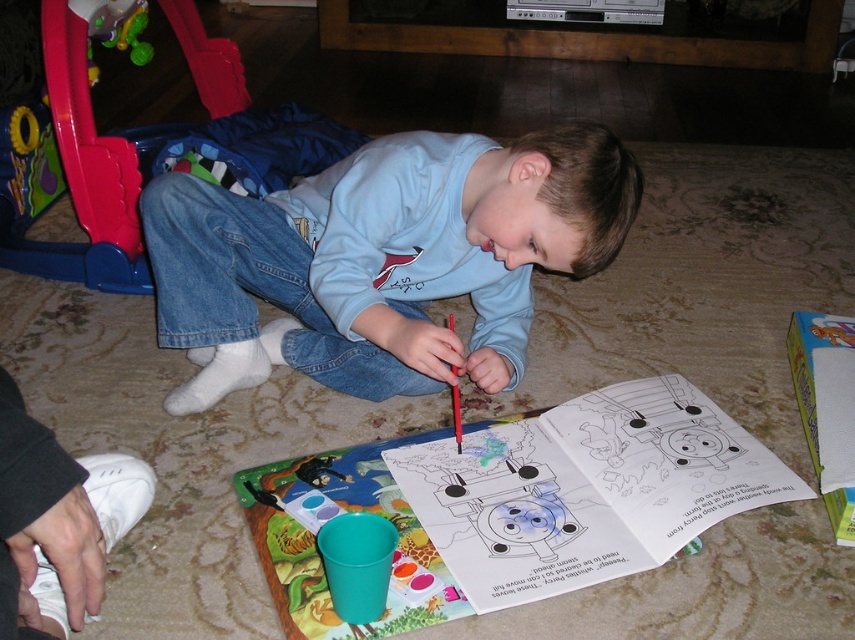
You are a parent trying to store the rubberized plastic walker at left and the matte plastic crayon at lower center in a narrow drawer. Given their sizes, which item will be harder to fit into the drawer?

The rubberized plastic walker at left will be harder to fit into the drawer because its width is larger than the matte plastic crayon at lower center.

You are a parent observing your child in the scene. You need to place a new toy that is 12 inches wide between the light blue cotton shirt at center and the rubberized plastic walker at left. Based on their widths, will there be enough space for the toy?

The light blue cotton shirt at center is narrower than the rubberized plastic walker at left. However, since the exact widths aren t provided, we can t determine if the combined space between them can accommodate a 12 inch wide toy. More information is needed.